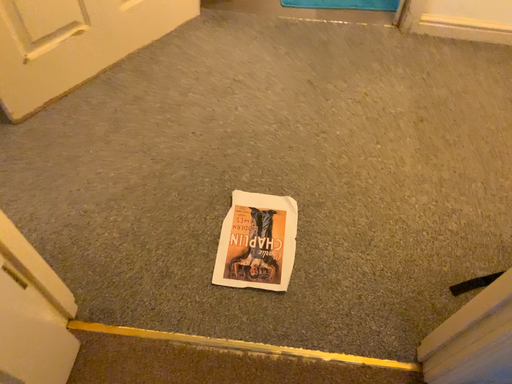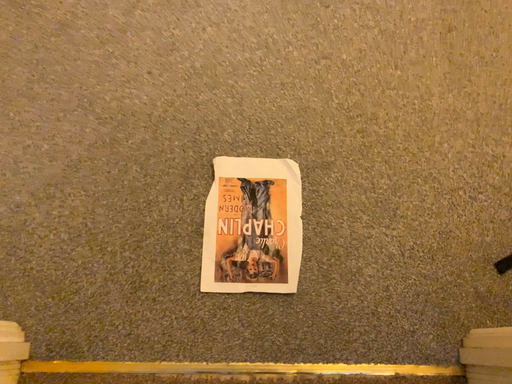
Question: Which way did the camera rotate in the video?

Choices:
 (A) rotated upward
 (B) rotated downward

Answer: (B)